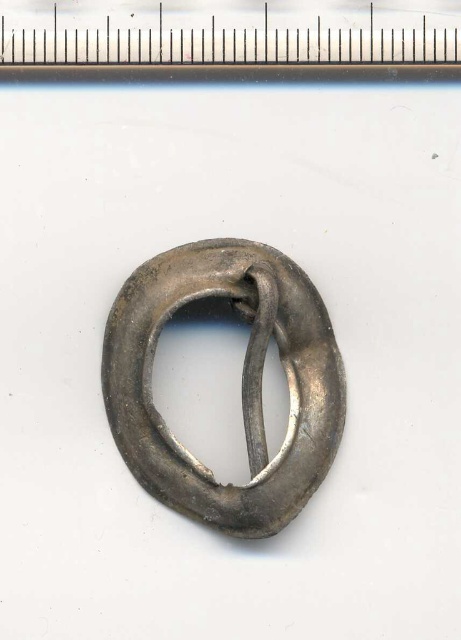
Question: Which object is farther from the camera taking this photo?

Choices:
 (A) shiny silver ring at center
 (B) metallic ruler at upper center

Answer: (A)

Question: Does shiny silver ring at center appear on the left side of metallic ruler at upper center?

Choices:
 (A) no
 (B) yes

Answer: (B)

Question: Does shiny silver ring at center appear over metallic ruler at upper center?

Choices:
 (A) yes
 (B) no

Answer: (B)

Question: Among these objects, which one is nearest to the camera?

Choices:
 (A) metallic ruler at upper center
 (B) shiny silver ring at center

Answer: (A)

Question: Among these objects, which one is farthest from the camera?

Choices:
 (A) metallic ruler at upper center
 (B) shiny silver ring at center

Answer: (B)

Question: Is the position of shiny silver ring at center more distant than that of metallic ruler at upper center?

Choices:
 (A) no
 (B) yes

Answer: (B)